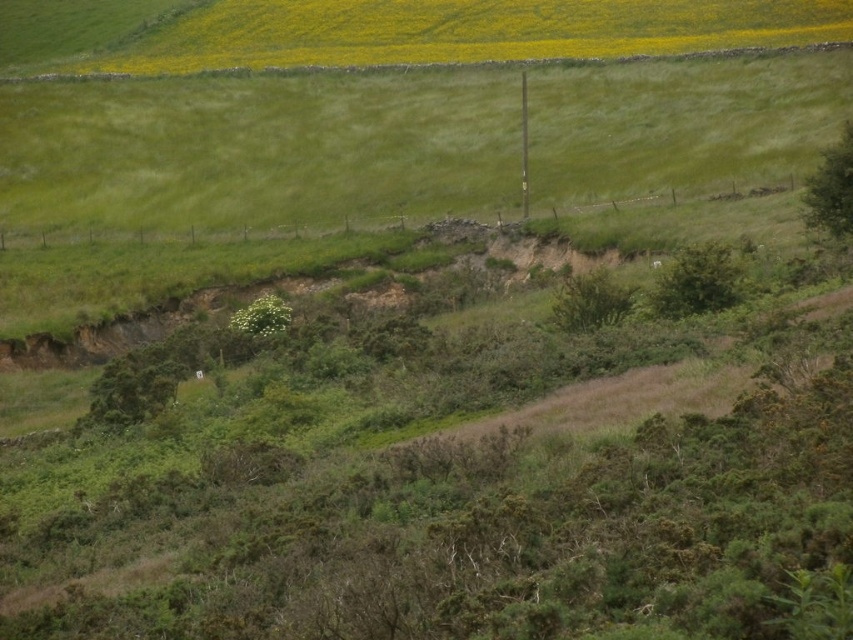
You are standing on the green grassy hillside at upper center and want to reach the green leafy plant at center. Which direction should you move to get closer to the plant?

Since the green grassy hillside at upper center is further to the viewer than the green leafy plant at center, you should move forward towards the plant to get closer.

You are a surveyor who needs to mark the exact location of the green grassy hillside at upper center on a map. What are the coordinates of this point?

The coordinates of the green grassy hillside at upper center are at point (258, 148).

You are standing at the bottom of the green grassy hillside at upper center and want to reach the green leafy plant at center. Which direction should you walk to get there?

The green grassy hillside at upper center is taller than the green leafy plant at center, so you should walk downhill towards the green leafy plant at center.